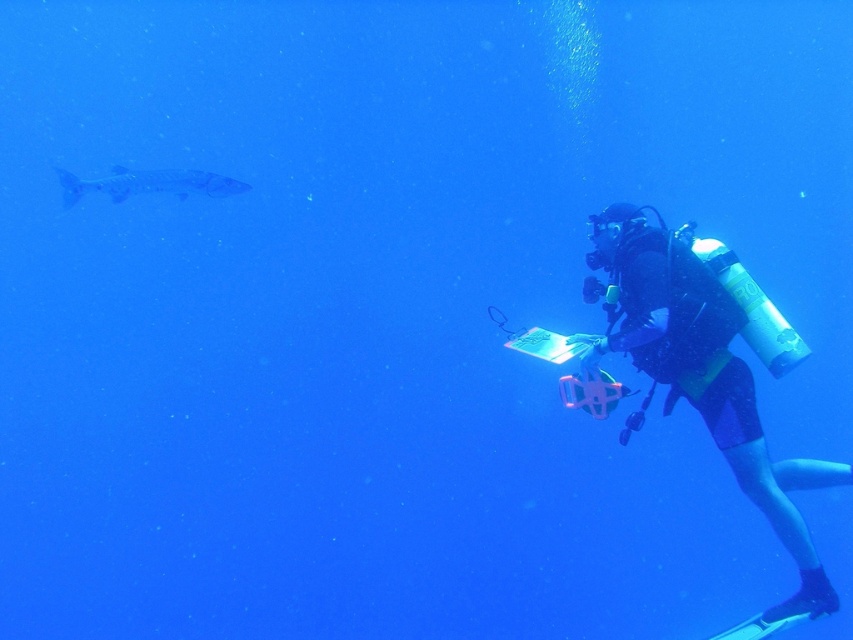
Question: Does black rubber wetsuit at right appear on the left side of smooth blue fish at left?

Choices:
 (A) no
 (B) yes

Answer: (A)

Question: Which point is closer to the camera?

Choices:
 (A) smooth blue fish at left
 (B) black rubber wetsuit at right

Answer: (B)

Question: From the image, what is the correct spatial relationship of black rubber wetsuit at right in relation to smooth blue fish at left?

Choices:
 (A) left
 (B) right

Answer: (B)

Question: Does black rubber wetsuit at right appear on the left side of smooth blue fish at left?

Choices:
 (A) no
 (B) yes

Answer: (A)